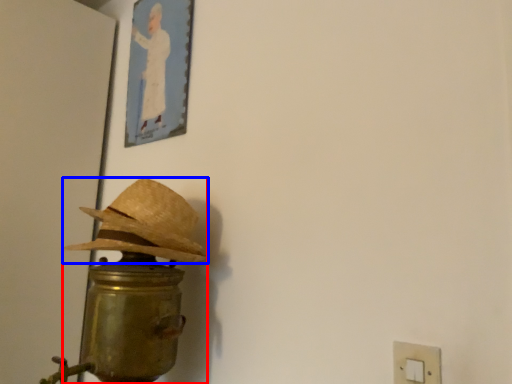
Question: Which of the following is the closest to the observer, table lamp (highlighted by a red box) or hat (highlighted by a blue box)?

Choices:
 (A) table lamp
 (B) hat

Answer: (A)